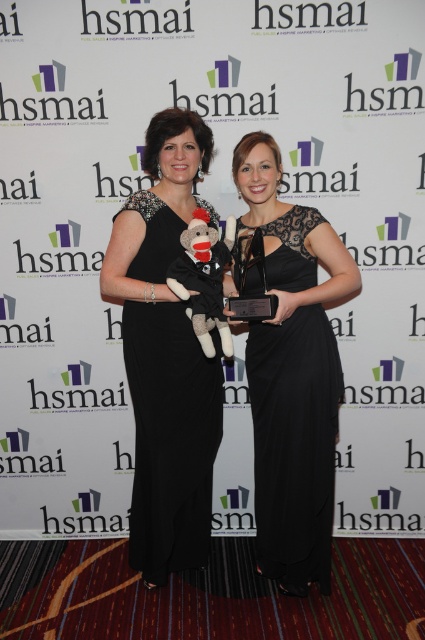
Is black lace dress at center bigger than black satin dress at left?

Actually, black lace dress at center might be smaller than black satin dress at left.

Where is `black lace dress at center`? This screenshot has width=425, height=640. black lace dress at center is located at coordinates (294, 442).